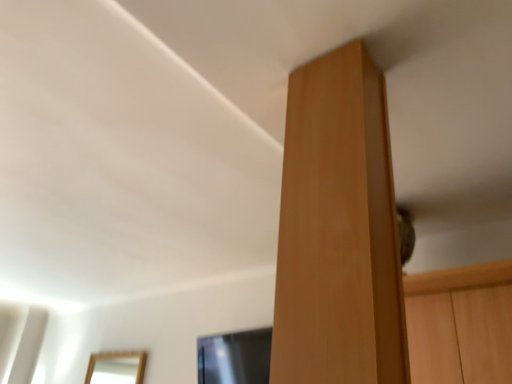
Where is `light brown wood door at center`? light brown wood door at center is located at coordinates (338, 230).

The image size is (512, 384). Describe the element at coordinates (338, 230) in the screenshot. I see `light brown wood door at center` at that location.

Identify the location of light brown wood door at center. (338, 230).